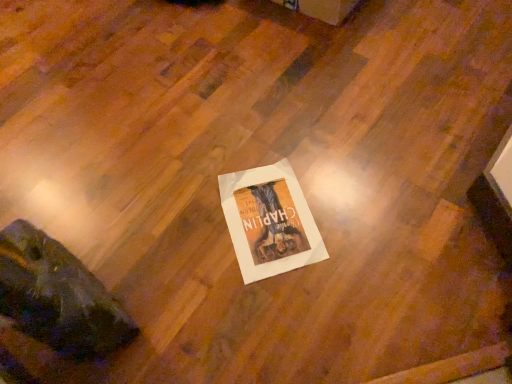
In order to click on vacant space underneath white paper book at center (from a real-world perspective) in this screenshot , I will do `click(272, 223)`.